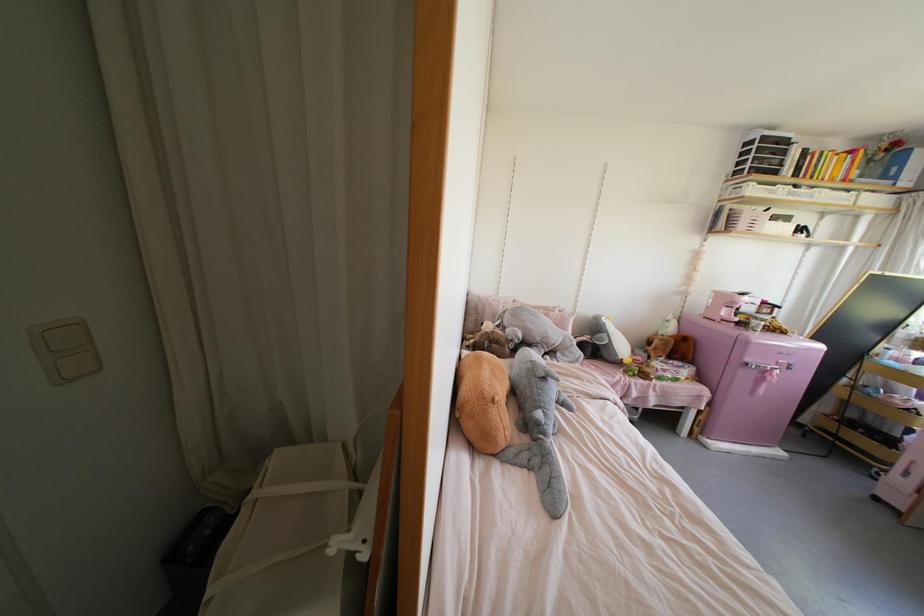
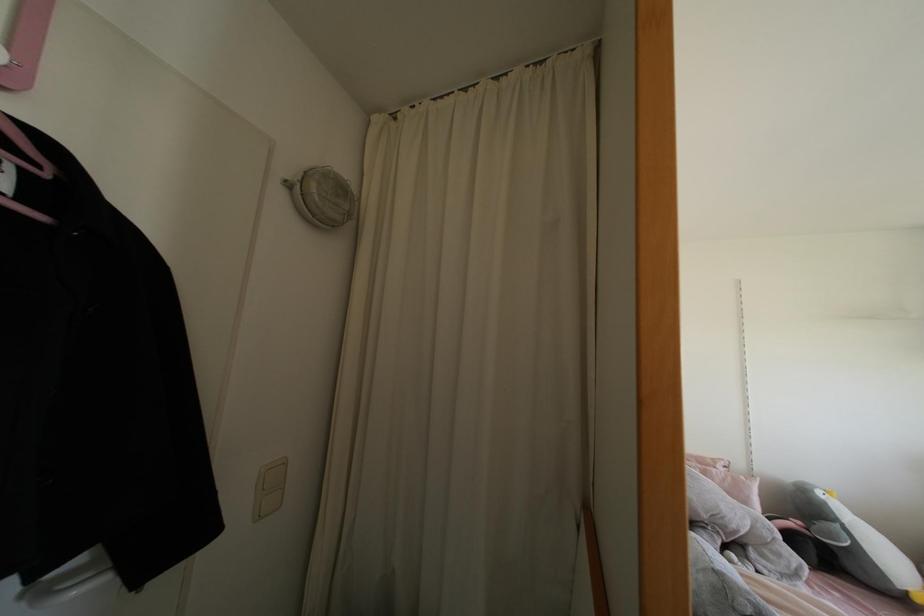
In the second image, find the point that corresponds to (x=66, y=379) in the first image.

(259, 517)